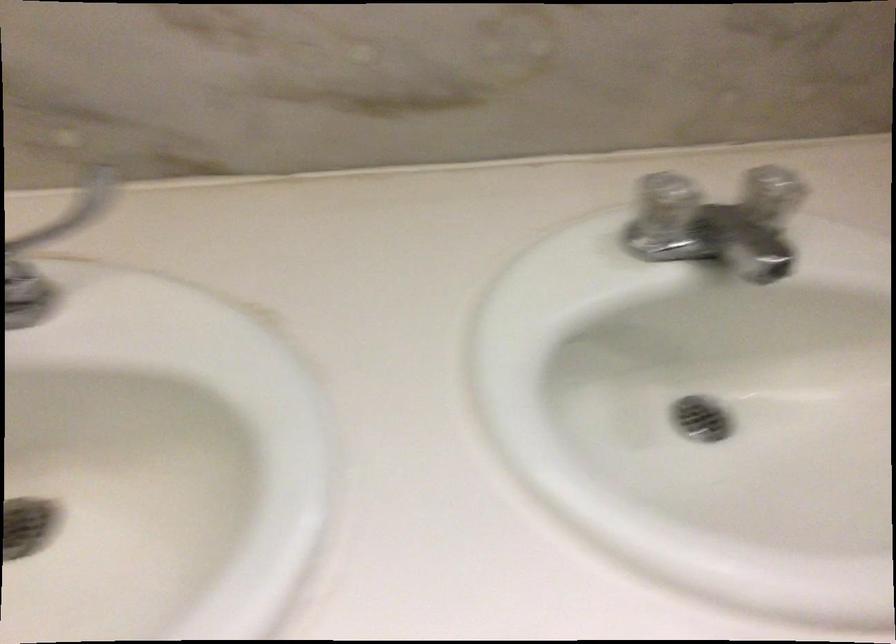
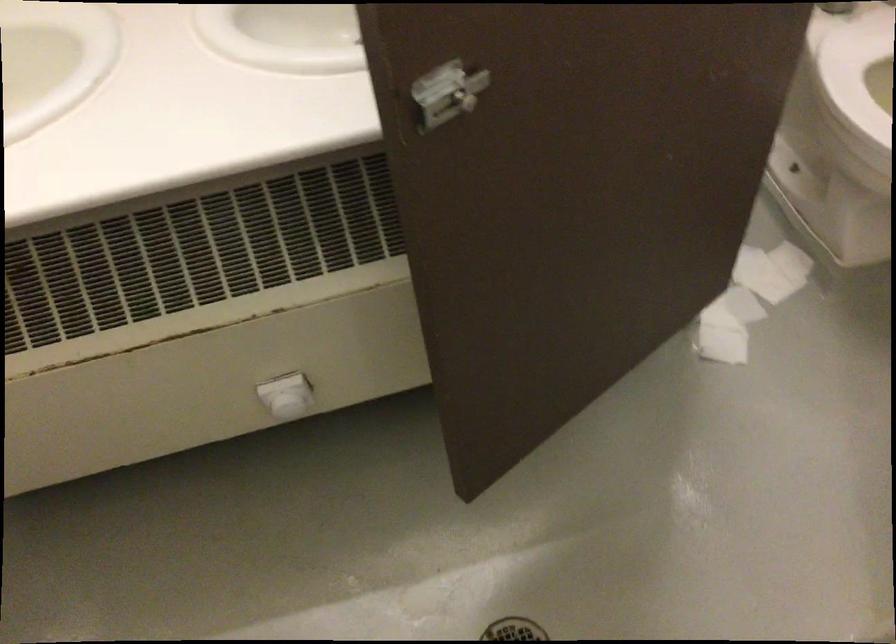
In a continuous first-person perspective shot, in which direction is the camera moving?

The cameraman moved toward right, backward.